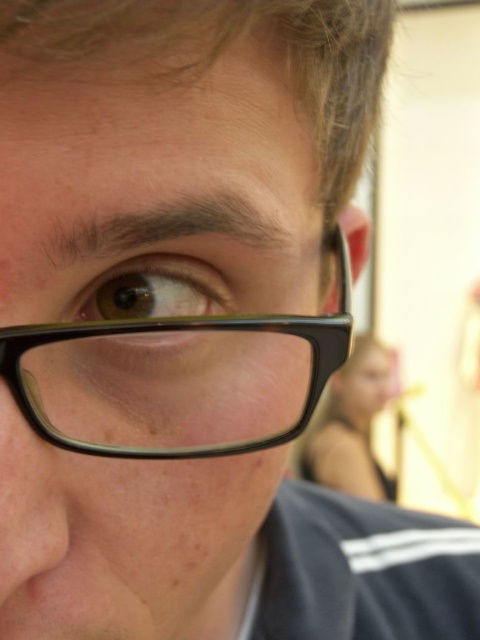
You are a photographer adjusting the focus of your camera. You notice two pairs of glasses on the person in the image. Which pair of glasses, the black matte glasses at center or the black plastic glasses at center, is closer to the camera?

The black matte glasses at center is taller than the black plastic glasses at center, so the black matte glasses at center is closer to the camera because objects closer to the camera appear larger.

Based on the scene description, where is the black matte glasses at center located in terms of coordinates?

The black matte glasses at center are located at coordinates point (156, 189).

Looking at the image, which object is positioned lower between the black plastic glasses at center and the brown matte eye at center?

The black plastic glasses at center are positioned lower than the brown matte eye at center.